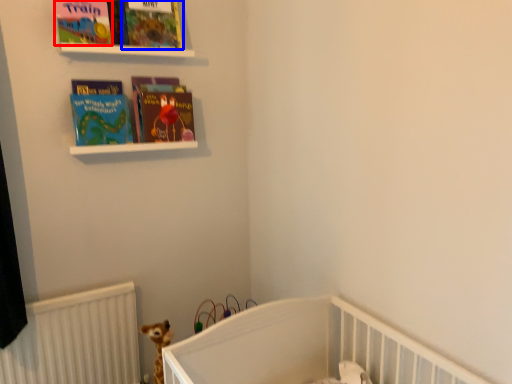
Question: Which object is closer to the camera taking this photo, book cover (highlighted by a red box) or book cover (highlighted by a blue box)?

Choices:
 (A) book cover
 (B) book cover

Answer: (A)